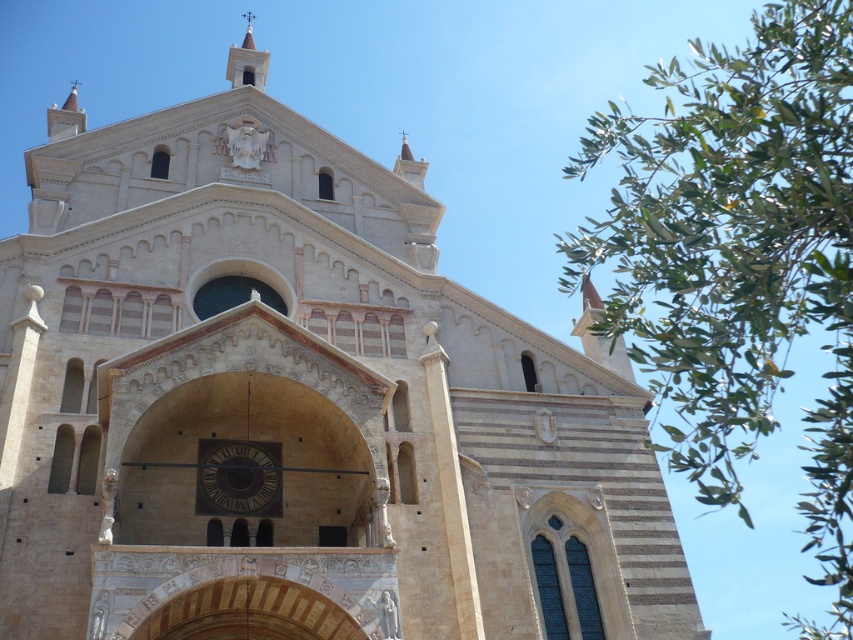
Question: Can you confirm if green leafy tree at upper right is positioned to the left of dark brown wooden clock at center?

Choices:
 (A) yes
 (B) no

Answer: (B)

Question: Which of the following is the farthest from the observer?

Choices:
 (A) green leafy tree at upper right
 (B) dark brown wooden clock at center

Answer: (B)

Question: Which object appears closest to the camera in this image?

Choices:
 (A) green leafy tree at upper right
 (B) dark brown wooden clock at center

Answer: (A)

Question: Does green leafy tree at upper right have a larger size compared to dark brown wooden clock at center?

Choices:
 (A) no
 (B) yes

Answer: (B)

Question: Considering the relative positions of green leafy tree at upper right and dark brown wooden clock at center in the image provided, where is green leafy tree at upper right located with respect to dark brown wooden clock at center?

Choices:
 (A) above
 (B) below

Answer: (A)